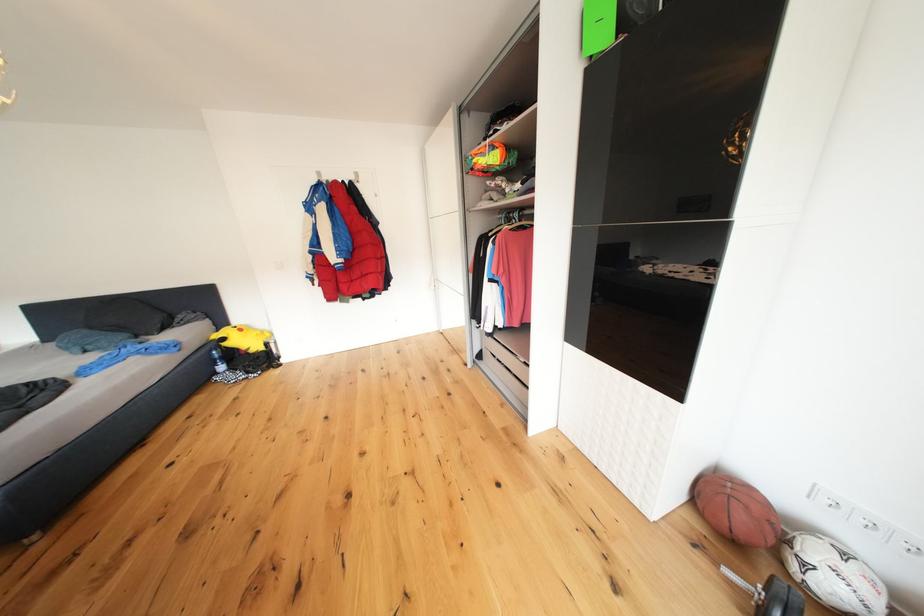
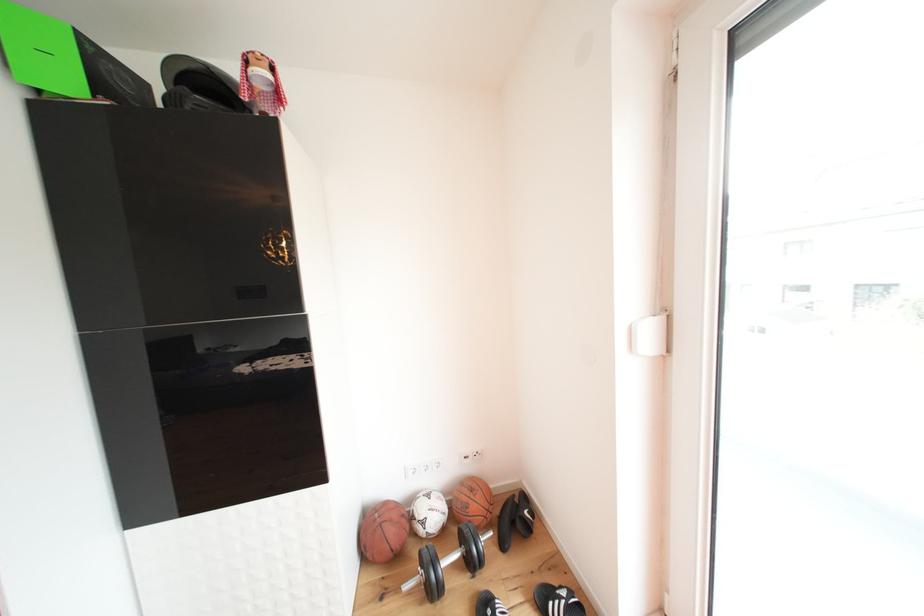
The point at (796,546) is marked in the first image. Where is the corresponding point in the second image?

(420, 523)